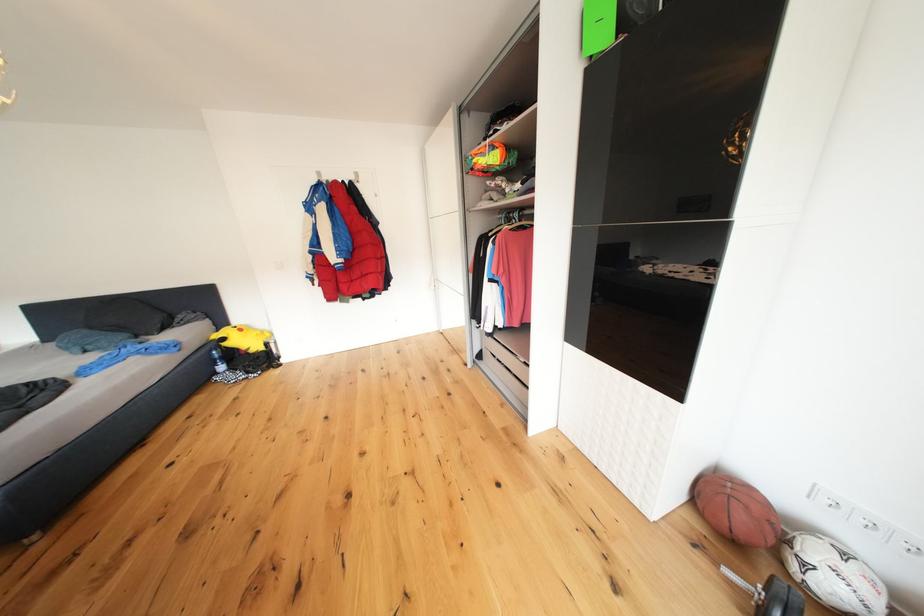
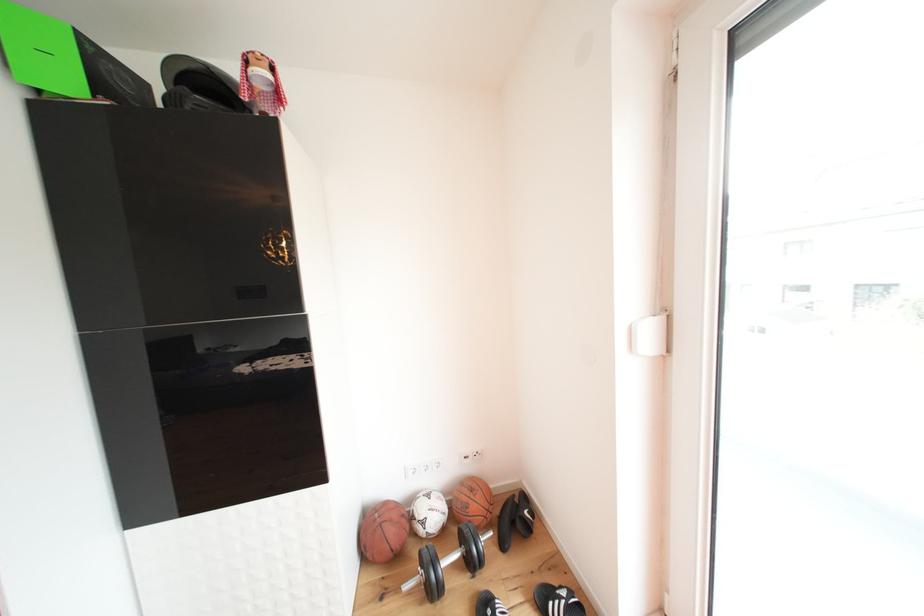
The point at (796,546) is marked in the first image. Where is the corresponding point in the second image?

(420, 523)